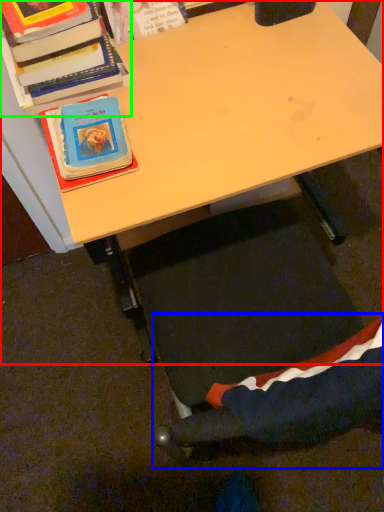
Question: Which object is the farthest from desk (highlighted by a red box)? Choose among these: swivel chair (highlighted by a blue box) or book (highlighted by a green box).

Choices:
 (A) swivel chair
 (B) book

Answer: (A)